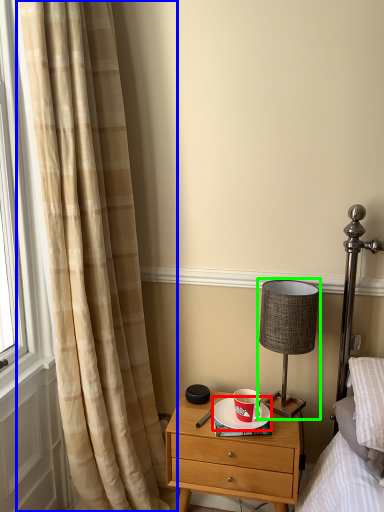
Question: Which is farther away from saucer (highlighted by a red box)? curtain (highlighted by a blue box) or table lamp (highlighted by a green box)?

Choices:
 (A) curtain
 (B) table lamp

Answer: (A)